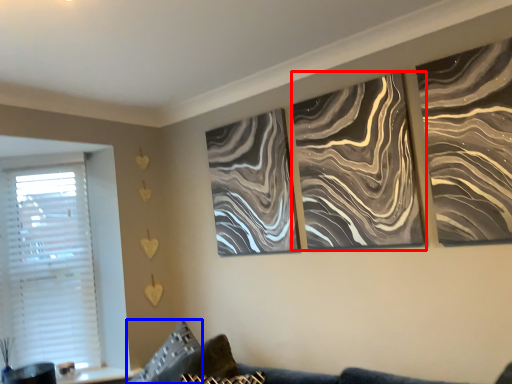
Question: Which object is further to the camera taking this photo, canvas (highlighted by a red box) or pillow (highlighted by a blue box)?

Choices:
 (A) canvas
 (B) pillow

Answer: (A)